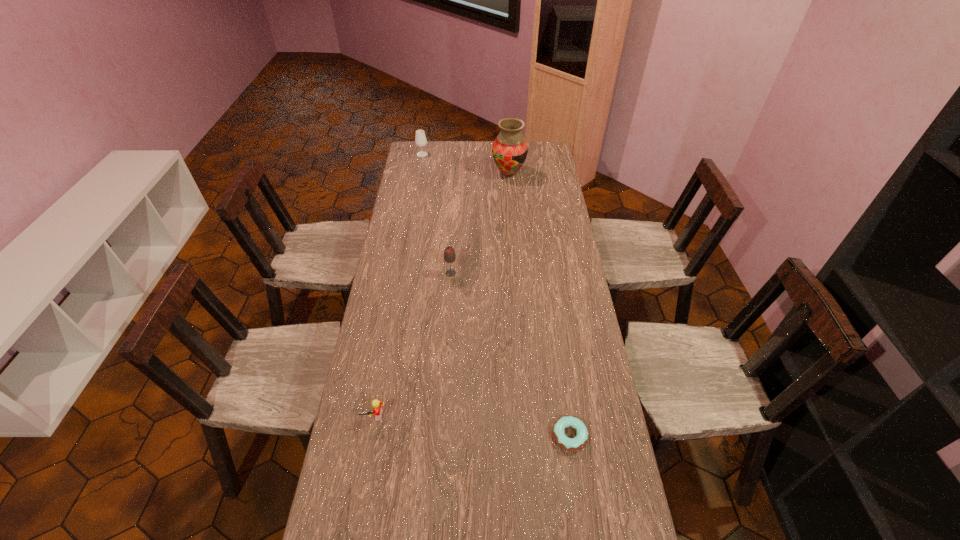
I want to click on free space between the Lego and the doughnut, so click(x=472, y=426).

In order to click on free space between the vase and the Lego in this screenshot , I will do `click(442, 295)`.

The width and height of the screenshot is (960, 540). What are the coordinates of `object identified as the third closest to the doughnut` in the screenshot? It's located at (510, 149).

Choose which object is the fourth nearest neighbor to the left glass drink container. Please provide its 2D coordinates. Your answer should be formatted as a tuple, i.e. [(x, y)], where the tuple contains the x and y coordinates of a point satisfying the conditions above.

[(571, 444)]

Image resolution: width=960 pixels, height=540 pixels. Find the location of `vacant position in the image that satisfies the following two spatial constraints: 1. in front of the doughnut with the accessory visible; 2. on the left side of the Lego`. vacant position in the image that satisfies the following two spatial constraints: 1. in front of the doughnut with the accessory visible; 2. on the left side of the Lego is located at coordinates (371, 436).

I want to click on free point that satisfies the following two spatial constraints: 1. on the front side of the shortest object; 2. on the right side of the vase, so click(530, 436).

You are a GUI agent. You are given a task and a screenshot of the screen. Output one action in this format:
    pyautogui.click(x=<x>, y=<y>)
    Task: Click on the vacant space that satisfies the following two spatial constraints: 1. on the back side of the vase; 2. on the left side of the third farthest object
    This screenshot has height=540, width=960.
    Given the screenshot: What is the action you would take?
    click(457, 173)